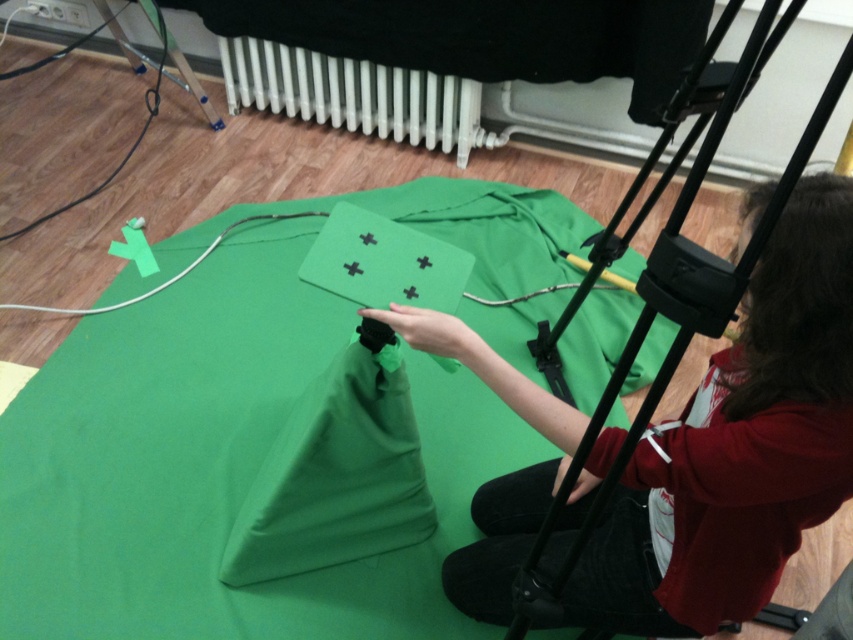
You are setting up a photography studio and need to place a camera on a tripod. The smooth green fabric at center is your backdrop. Where should you position the camera relative to the white plastic radiator at upper center to ensure the backdrop is fully visible in the shot?

The smooth green fabric at center is below the white plastic radiator at upper center, so positioning the camera below the radiator will keep the green backdrop in frame.

You are setting up a photography studio and need to place a tripod between the green matte cloth at center and the white plastic radiator at upper center. Based on their positions, where should you position the tripod?

The green matte cloth at center is located below the white plastic radiator at upper center, so the tripod should be placed between them, below the radiator and above the cloth.

You are a photographer setting up for a shoot. You have a camera positioned at a certain distance from the green matte cloth at center. If the recommended safe distance for optimal green screen lighting is 1.5 meters, is your camera within the recommended distance?

The green matte cloth at center and camera are 1.65 meters apart from each other, which exceeds the recommended 1.5 meters distance. Therefore, the camera is slightly too far away for optimal green screen lighting.